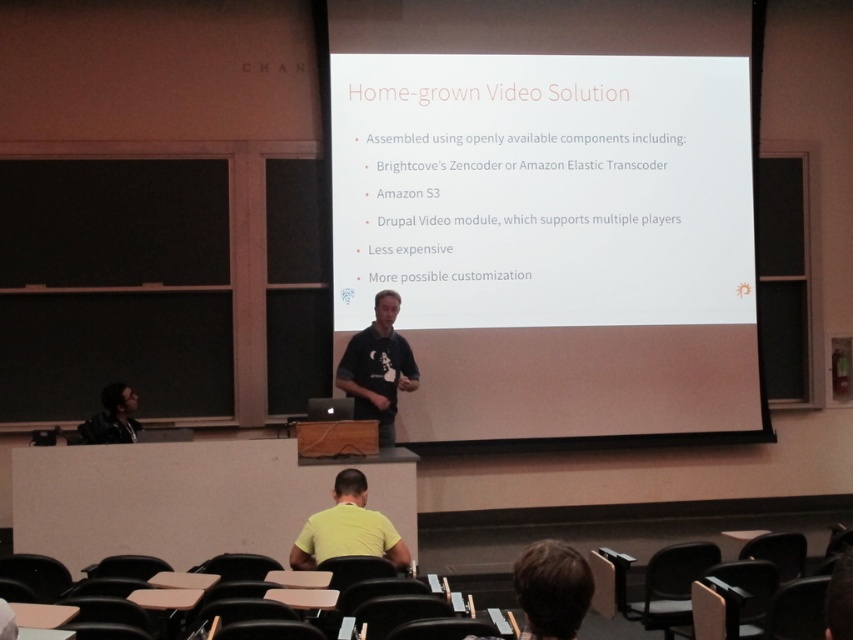
Question: Which object appears farthest from the camera in this image?

Choices:
 (A) black t-shirt at center
 (B) yellow matte shirt at lower center

Answer: (A)

Question: Can you confirm if yellow matte shirt at lower center is smaller than dark gray hoodie at lower left?

Choices:
 (A) no
 (B) yes

Answer: (A)

Question: Is yellow matte shirt at lower center further to camera compared to dark gray hoodie at lower left?

Choices:
 (A) no
 (B) yes

Answer: (A)

Question: Can you confirm if black t-shirt at center is bigger than yellow matte shirt at lower center?

Choices:
 (A) yes
 (B) no

Answer: (A)

Question: Which is nearer to the black t-shirt at center?

Choices:
 (A) white matte projector screen at center
 (B) dark gray hoodie at lower left
 (C) yellow matte shirt at lower center

Answer: (A)

Question: Among these objects, which one is farthest from the camera?

Choices:
 (A) white matte projector screen at center
 (B) dark gray hoodie at lower left

Answer: (A)